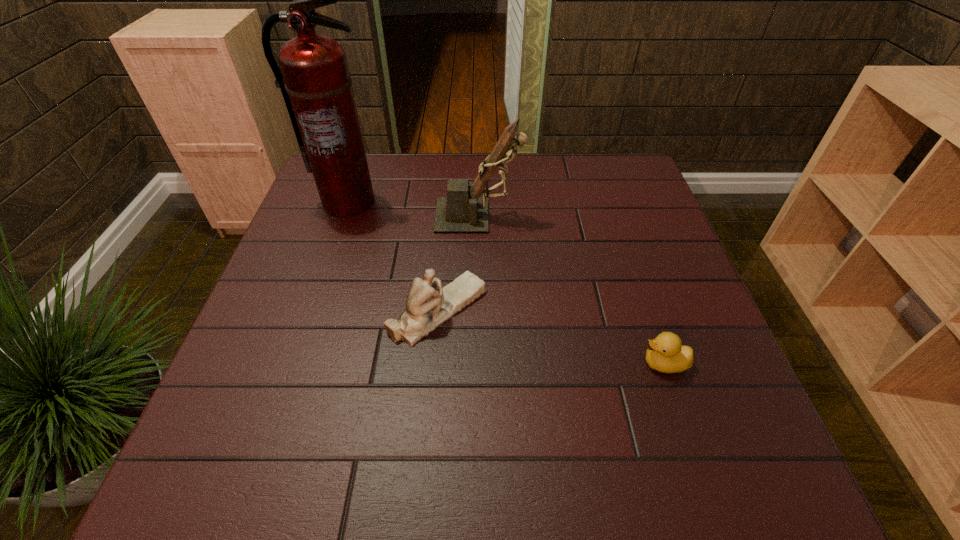
Where is `fire extinguisher`? fire extinguisher is located at coordinates (315, 82).

This screenshot has width=960, height=540. In order to click on the leftmost object in this screenshot , I will do `click(315, 82)`.

Identify the location of the farther figurine. Image resolution: width=960 pixels, height=540 pixels. (463, 210).

The width and height of the screenshot is (960, 540). I want to click on the taller figurine, so click(463, 210).

Where is `the third farthest object`? This screenshot has height=540, width=960. the third farthest object is located at coordinates (428, 305).

Image resolution: width=960 pixels, height=540 pixels. In order to click on the third tallest object in this screenshot , I will do click(428, 305).

Find the location of a particular element. duckling is located at coordinates (665, 353).

The height and width of the screenshot is (540, 960). I want to click on the shortest object, so click(x=665, y=353).

The width and height of the screenshot is (960, 540). What are the coordinates of `free location located on the nozzle side of the tallest object` in the screenshot? It's located at (309, 312).

I want to click on free space located 0.370m on the front-facing side of the taller figurine, so click(x=658, y=215).